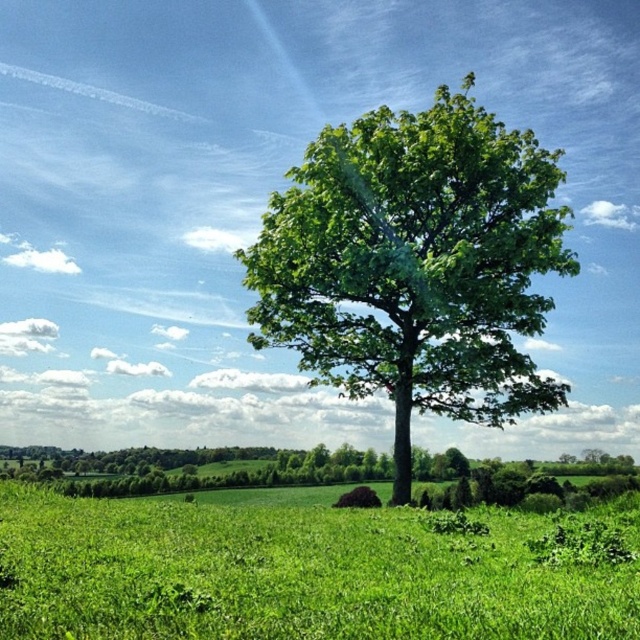
Locate an element on the screen. The width and height of the screenshot is (640, 640). green grassy field at center is located at coordinates (305, 572).

Who is lower down, green grassy field at center or green leafy tree at center?

green grassy field at center is below.

Between point (634, 529) and point (456, 365), which one is positioned in front?

Point (634, 529)

What are the coordinates of `green grassy field at center` in the screenshot? It's located at pos(305,572).